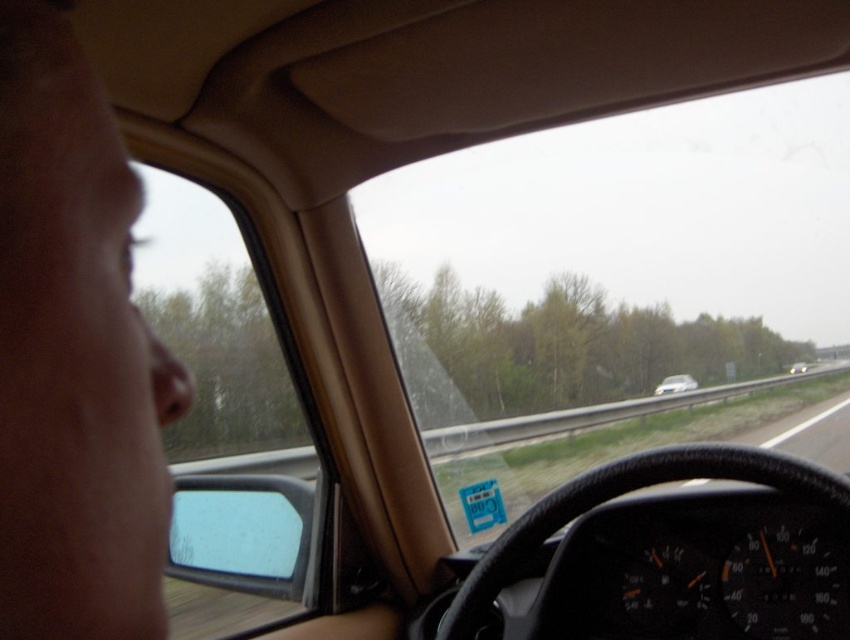
Question: Does transparent glass windshield at upper center have a smaller size compared to transparent glass windshield at upper left?

Choices:
 (A) yes
 (B) no

Answer: (B)

Question: Which point is closer to the camera?

Choices:
 (A) (797, 365)
 (B) (445, 436)
 (C) (144, 609)
 (D) (265, 388)

Answer: (C)

Question: Does transparent glass windshield at upper center appear over transparent glass windshield at upper left?

Choices:
 (A) yes
 (B) no

Answer: (A)

Question: Is transparent glass windshield at upper center to the left of skinny flesh-toned face at left from the viewer's perspective?

Choices:
 (A) yes
 (B) no

Answer: (B)

Question: Which object appears farthest from the camera in this image?

Choices:
 (A) silver metallic sedan at center
 (B) transparent glass windshield at upper left
 (C) transparent glass windshield at upper center

Answer: (A)

Question: Based on their relative distances, which object is nearer to the skinny flesh-toned face at left?

Choices:
 (A) silver metallic sedan at center
 (B) white glossy sedan at center
 (C) transparent glass windshield at upper left
 (D) transparent glass windshield at upper center

Answer: (C)